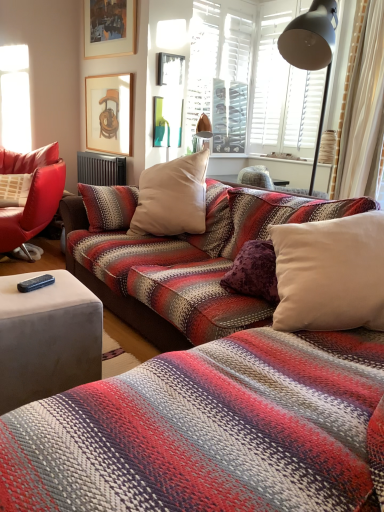
Question: Does black rubber remote control at lower left lie behind dark gray metallic radiator at center?

Choices:
 (A) no
 (B) yes

Answer: (A)

Question: Is black rubber remote control at lower left touching dark gray metallic radiator at center?

Choices:
 (A) no
 (B) yes

Answer: (A)

Question: Is black rubber remote control at lower left wider than dark gray metallic radiator at center?

Choices:
 (A) yes
 (B) no

Answer: (A)

Question: From a real-world perspective, does black rubber remote control at lower left stand above dark gray metallic radiator at center?

Choices:
 (A) yes
 (B) no

Answer: (B)

Question: Is black rubber remote control at lower left completely or partially outside of dark gray metallic radiator at center?

Choices:
 (A) yes
 (B) no

Answer: (A)

Question: Is black rubber remote control at lower left not near dark gray metallic radiator at center?

Choices:
 (A) yes
 (B) no

Answer: (A)

Question: From a real-world perspective, does dark gray metallic radiator at center sit lower than wooden picture frame at upper center, which is counted as the first picture frame, starting from the top?

Choices:
 (A) no
 (B) yes

Answer: (B)

Question: From a real-world perspective, is dark gray metallic radiator at center on wooden picture frame at upper center, marked as the 3th picture frame in a bottom-to-top arrangement?

Choices:
 (A) no
 (B) yes

Answer: (A)

Question: Can you confirm if dark gray metallic radiator at center is bigger than wooden picture frame at upper center, which is counted as the first picture frame, starting from the top?

Choices:
 (A) yes
 (B) no

Answer: (A)

Question: Does dark gray metallic radiator at center appear on the left side of wooden picture frame at upper center, marked as the 3th picture frame in a bottom-to-top arrangement?

Choices:
 (A) yes
 (B) no

Answer: (A)

Question: Is dark gray metallic radiator at center not near wooden picture frame at upper center, which is counted as the first picture frame, starting from the top?

Choices:
 (A) no
 (B) yes

Answer: (B)

Question: Can you confirm if dark gray metallic radiator at center is taller than wooden picture frame at upper center, which is counted as the first picture frame, starting from the top?

Choices:
 (A) no
 (B) yes

Answer: (A)

Question: Considering the relative positions of wooden framed picture at upper left, the 3th picture frame in the top-to-bottom sequence, and dark gray metallic radiator at center in the image provided, is wooden framed picture at upper left, the 3th picture frame in the top-to-bottom sequence, in front of dark gray metallic radiator at center?

Choices:
 (A) yes
 (B) no

Answer: (A)